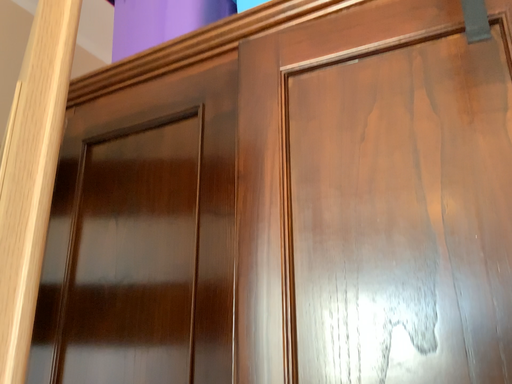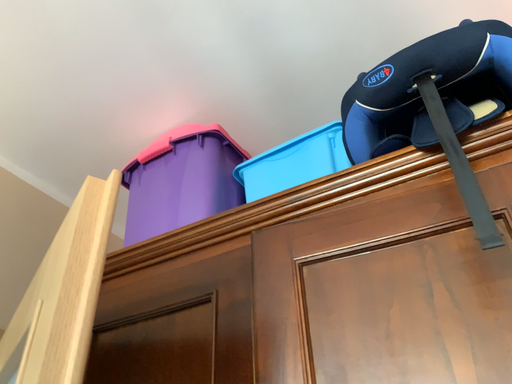
Question: Which way did the camera rotate in the video?

Choices:
 (A) rotated downward
 (B) rotated upward

Answer: (B)